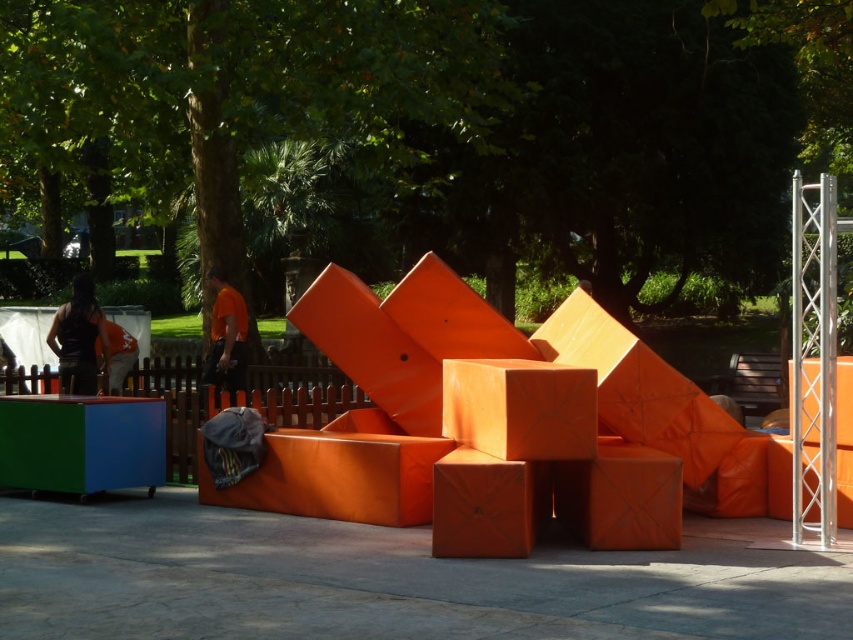
You are standing in the outdoor area looking at the orange cube structures. There are two points marked on the ground, one at point (x=468, y=524) and the other at point (x=68, y=310). Which point is closer to your current position?

Point (x=468, y=524) is closer to the camera than point (x=68, y=310), so the point at (x=468, y=524) is closer to your current position.

You are a visitor standing in front of the orange cubes. You notice the matte orange cube at center and the black fabric at left. Which object is nearer to you?

The matte orange cube at center is closer to the viewer than the black fabric at left.